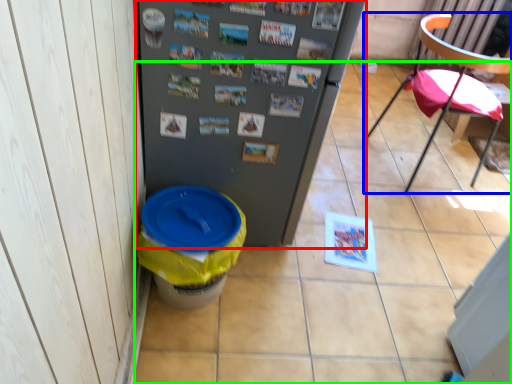
Question: Estimate the real-world distances between objects in this image. Which object is closer to refrigerator (highlighted by a red box), chair (highlighted by a blue box) or tile (highlighted by a green box)?

Choices:
 (A) chair
 (B) tile

Answer: (B)